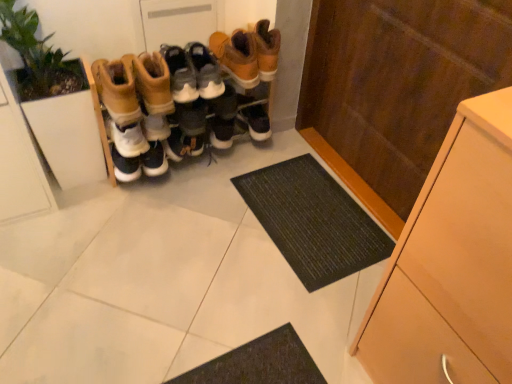
Question: Is matte wood cupboard at right shorter than leather boots at center, the 2th footwear viewed from the left?

Choices:
 (A) no
 (B) yes

Answer: (A)

Question: Can you confirm if matte wood cupboard at right is positioned to the right of leather boots at center, the 2th footwear viewed from the left?

Choices:
 (A) no
 (B) yes

Answer: (B)

Question: Is matte wood cupboard at right oriented away from leather boots at center, the second footwear in the right-to-left sequence?

Choices:
 (A) no
 (B) yes

Answer: (A)

Question: From the image's perspective, does matte wood cupboard at right appear higher than leather boots at center, the 2th footwear viewed from the left?

Choices:
 (A) no
 (B) yes

Answer: (A)

Question: From a real-world perspective, is matte wood cupboard at right over leather boots at center, the second footwear in the right-to-left sequence?

Choices:
 (A) no
 (B) yes

Answer: (B)

Question: Could you tell me if matte wood cupboard at right is turned towards leather boots at center, the 2th footwear viewed from the left?

Choices:
 (A) no
 (B) yes

Answer: (B)

Question: Is leather boots at center, the 1th footwear in the left-to-right sequence, at the back of matte wood cupboard at right?

Choices:
 (A) yes
 (B) no

Answer: (B)

Question: From a real-world perspective, is matte wood cupboard at right positioned under leather boots at center, the 1th footwear in the left-to-right sequence, based on gravity?

Choices:
 (A) no
 (B) yes

Answer: (A)

Question: From a real-world perspective, is matte wood cupboard at right on top of leather boots at center, the 3th footwear viewed from the right?

Choices:
 (A) no
 (B) yes

Answer: (B)

Question: Does matte wood cupboard at right lie in front of leather boots at center, the 1th footwear in the left-to-right sequence?

Choices:
 (A) no
 (B) yes

Answer: (B)

Question: Can you confirm if matte wood cupboard at right is taller than leather boots at center, the 3th footwear viewed from the right?

Choices:
 (A) no
 (B) yes

Answer: (B)

Question: From the image's perspective, is matte wood cupboard at right on top of leather boots at center, the 1th footwear in the left-to-right sequence?

Choices:
 (A) yes
 (B) no

Answer: (B)

Question: Considering the relative sizes of leather boots at center, the 3th footwear viewed from the right, and green leafy plant at left in the image provided, is leather boots at center, the 3th footwear viewed from the right, taller than green leafy plant at left?

Choices:
 (A) yes
 (B) no

Answer: (B)